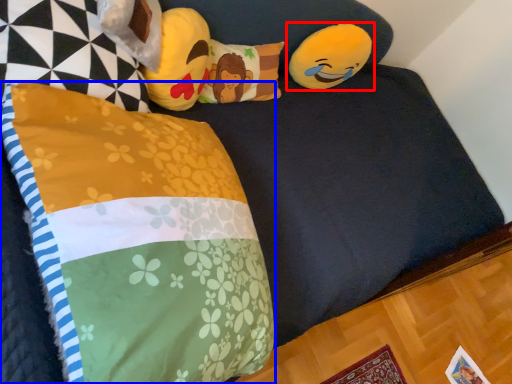
Question: Which object is closer to the camera taking this photo, toy (highlighted by a red box) or pillow (highlighted by a blue box)?

Choices:
 (A) toy
 (B) pillow

Answer: (B)